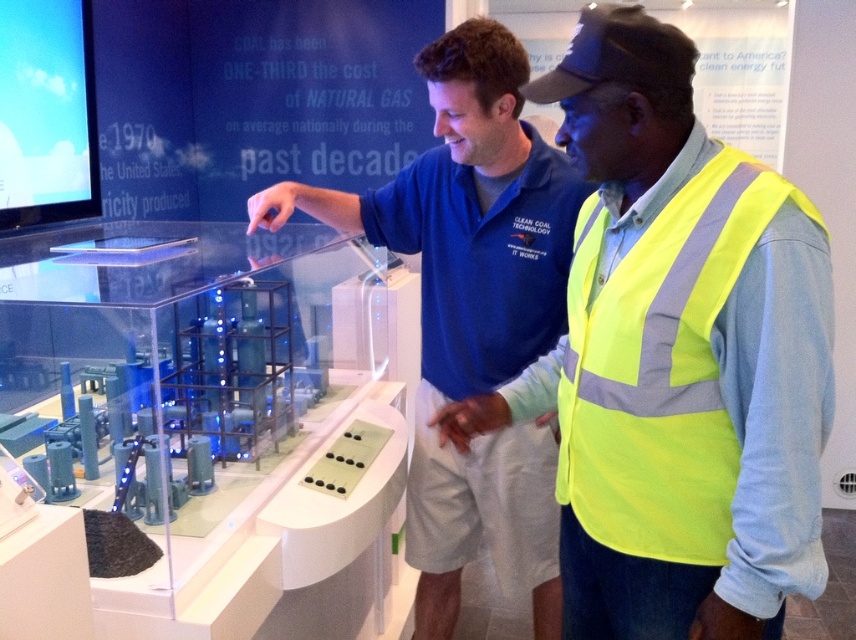
Can you confirm if neon yellow safety vest at center is wider than neon yellow reflective vest at right?

Correct, the width of neon yellow safety vest at center exceeds that of neon yellow reflective vest at right.

Does neon yellow safety vest at center have a greater height compared to neon yellow reflective vest at right?

Yes, neon yellow safety vest at center is taller than neon yellow reflective vest at right.

This screenshot has width=856, height=640. I want to click on neon yellow safety vest at center, so click(730, 464).

At what (x,y) coordinates should I click in order to perform the action: click on neon yellow safety vest at center. Please return your answer as a coordinate pair (x, y). Looking at the image, I should click on [x=730, y=464].

Which is below, blue shirt at center or neon yellow reflective vest at right?

Positioned lower is blue shirt at center.

This screenshot has width=856, height=640. What do you see at coordinates (473, 312) in the screenshot?
I see `blue shirt at center` at bounding box center [473, 312].

The height and width of the screenshot is (640, 856). Identify the location of blue shirt at center. (473, 312).

In the scene shown: Between neon yellow safety vest at center and blue shirt at center, which one appears on the left side from the viewer's perspective?

Positioned to the left is blue shirt at center.

Is neon yellow safety vest at center wider than blue shirt at center?

No, neon yellow safety vest at center is not wider than blue shirt at center.

This screenshot has height=640, width=856. I want to click on neon yellow safety vest at center, so click(730, 464).